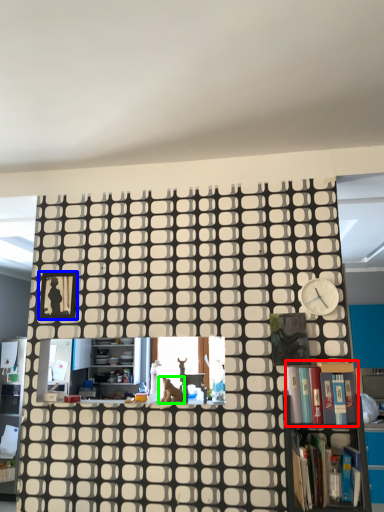
Question: Which object is positioned farthest from book (highlighted by a red box)? Select from picture frame (highlighted by a blue box) and animal (highlighted by a green box).

Choices:
 (A) picture frame
 (B) animal

Answer: (A)